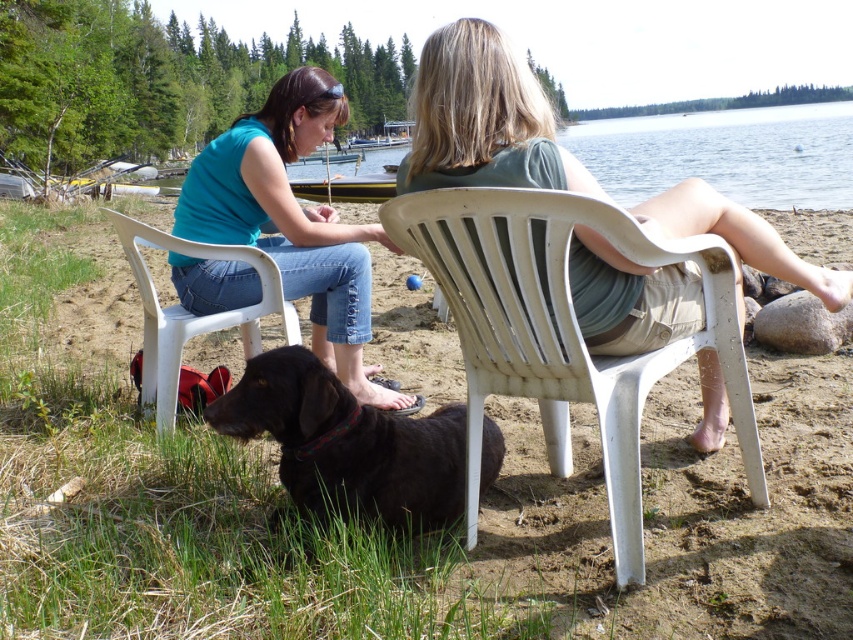
Question: Is brown fur dog at center above matte blue shirt at upper left?

Choices:
 (A) yes
 (B) no

Answer: (B)

Question: Which of these objects is positioned farthest from the brown fur dog at center?

Choices:
 (A) shiny black dog at lower center
 (B) white plastic chair at lower left

Answer: (B)

Question: Is white plastic chair at center bigger than shiny black dog at lower center?

Choices:
 (A) no
 (B) yes

Answer: (B)

Question: Can you confirm if white plastic chair at center is positioned to the left of shiny black dog at lower center?

Choices:
 (A) no
 (B) yes

Answer: (A)

Question: Which point appears farthest from the camera in this image?

Choices:
 (A) (228, 481)
 (B) (509, 93)

Answer: (A)

Question: Among these objects, which one is nearest to the camera?

Choices:
 (A) matte blue shirt at upper left
 (B) shiny black dog at lower center
 (C) brown fur dog at center

Answer: (C)